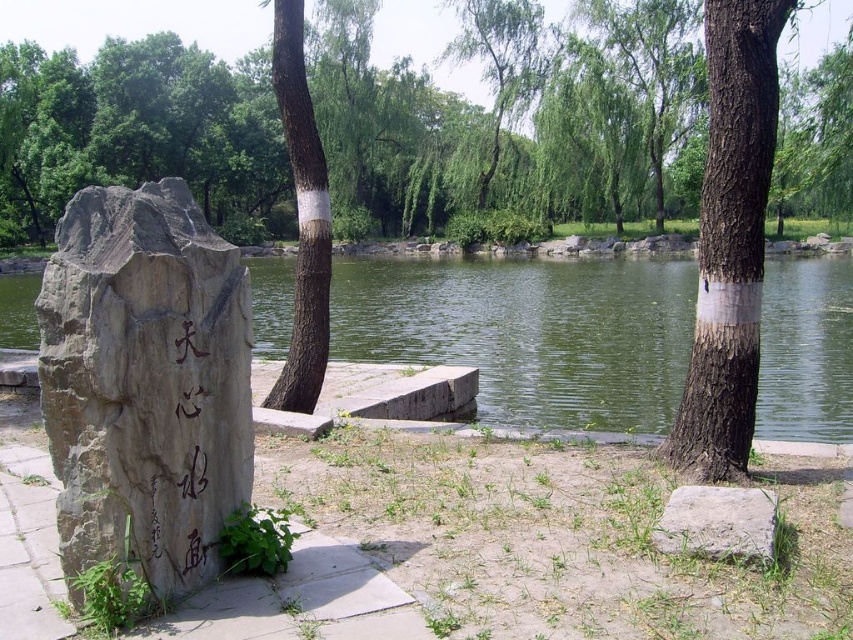
You are standing in the park and want to take a photo of both the brown rough bark tree at center and the green leafy tree at upper center. Which tree should you focus on first to ensure both are in clear view?

You should focus on the brown rough bark tree at center first because it is closer to the viewer than the green leafy tree at upper center, ensuring both are in clear view when focused on the closer one.

You are standing in the park and want to take a photo of both the brown rough bark tree at right and the green leafy tree at upper center. Which tree should you focus on first to ensure both are in the frame?

The brown rough bark tree at right is located below the green leafy tree at upper center, so you should focus on the green leafy tree at upper center first to ensure both are in the frame.

You are a gardener trying to water the gray rough stone at lower right. There is a brown rough bark tree at right above it. Can you reach the stone without moving the tree?

The brown rough bark tree at right is positioned over gray rough stone at lower right, so you cannot reach the stone without moving the tree.